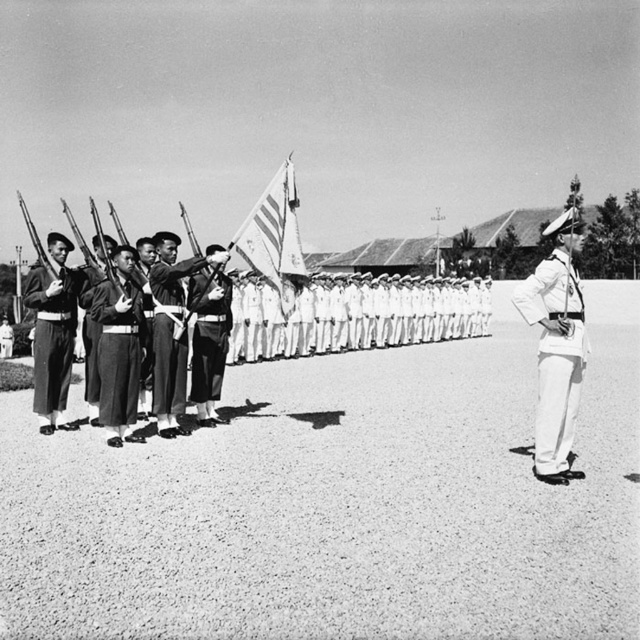
You are a photographer positioned at the front of the ceremony. You want to take a photo focusing on the uniformed soldier at center and the dark gray fabric uniform at left. Which soldier will appear larger in your photo?

The uniformed soldier at center will appear larger in the photo because they are closer to the viewer compared to the dark gray fabric uniform at left.